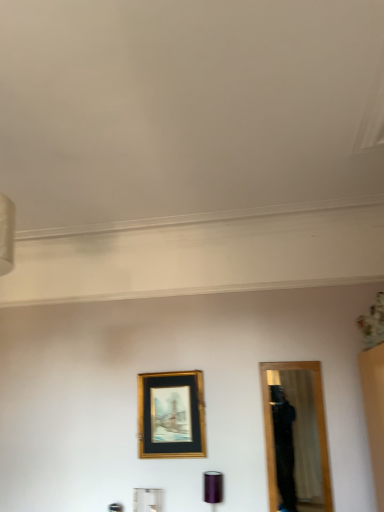
What do you see at coordinates (171, 415) in the screenshot?
I see `gold metallic picture frame at center` at bounding box center [171, 415].

Measure the distance between point (148,392) and camera.

Point (148,392) is 11.16 feet away from camera.

You are a GUI agent. You are given a task and a screenshot of the screen. Output one action in this format:
    pyautogui.click(x=<x>, y=<y>)
    Task: Click on the gold metallic picture frame at center
    
    Given the screenshot: What is the action you would take?
    pyautogui.click(x=171, y=415)

In order to face purple metallic cylinder at lower center, should I rotate leftwards or rightwards?

A 2.907 degree turn to the right will do.

Locate an element on the screen. This screenshot has height=512, width=384. purple metallic cylinder at lower center is located at coordinates (213, 488).

This screenshot has width=384, height=512. What do you see at coordinates (213, 488) in the screenshot?
I see `purple metallic cylinder at lower center` at bounding box center [213, 488].

Identify the location of gold metallic picture frame at center. [171, 415].

Considering the positions of objects gold metallic picture frame at center and purple metallic cylinder at lower center in the image provided, who is more to the left, gold metallic picture frame at center or purple metallic cylinder at lower center?

gold metallic picture frame at center.

In the image, is gold metallic picture frame at center positioned in front of or behind purple metallic cylinder at lower center?

Visually, gold metallic picture frame at center is located behind purple metallic cylinder at lower center.

Does point (180, 452) come behind point (212, 490)?

Yes, point (180, 452) is farther from viewer.

Based on the photo, from the image's perspective, is gold metallic picture frame at center on purple metallic cylinder at lower center?

Yes, from the image's perspective, gold metallic picture frame at center is above purple metallic cylinder at lower center.

From a real-world perspective, is gold metallic picture frame at center positioned under purple metallic cylinder at lower center based on gravity?

No, from a real-world perspective, gold metallic picture frame at center is not beneath purple metallic cylinder at lower center.

In the scene shown: Which of these two, gold metallic picture frame at center or purple metallic cylinder at lower center, is thinner?

Thinner between the two is gold metallic picture frame at center.

Is gold metallic picture frame at center taller or shorter than purple metallic cylinder at lower center?

Clearly, gold metallic picture frame at center is taller compared to purple metallic cylinder at lower center.

Based on their sizes in the image, would you say gold metallic picture frame at center is bigger or smaller than purple metallic cylinder at lower center?

Considering their sizes, gold metallic picture frame at center takes up more space than purple metallic cylinder at lower center.

Can we say gold metallic picture frame at center lies outside purple metallic cylinder at lower center?

That's correct, gold metallic picture frame at center is outside of purple metallic cylinder at lower center.

Is gold metallic picture frame at center not close to purple metallic cylinder at lower center?

No, there isn't a large distance between gold metallic picture frame at center and purple metallic cylinder at lower center.

Could you tell me if gold metallic picture frame at center is turned towards purple metallic cylinder at lower center?

No, gold metallic picture frame at center is not aimed at purple metallic cylinder at lower center.

Consider the image. How many degrees apart are the facing directions of gold metallic picture frame at center and purple metallic cylinder at lower center?

They differ by 0.761 degrees in their facing directions.

How much distance is there between gold metallic picture frame at center and purple metallic cylinder at lower center?

They are 19.01 inches apart.

At what (x,y) coordinates should I click in order to perform the action: click on picture frame that appears on the left of purple metallic cylinder at lower center. Please return your answer as a coordinate pair (x, y). The image size is (384, 512). Looking at the image, I should click on (171, 415).

Which is more to the right, purple metallic cylinder at lower center or gold metallic picture frame at center?

purple metallic cylinder at lower center is more to the right.

Is purple metallic cylinder at lower center in front of gold metallic picture frame at center?

Yes, purple metallic cylinder at lower center is closer to the viewer.

Considering the points (208, 494) and (179, 380), which point is in front, point (208, 494) or point (179, 380)?

The point (208, 494) is closer to the camera.

From the image's perspective, between purple metallic cylinder at lower center and gold metallic picture frame at center, who is located below?

From the image's view, purple metallic cylinder at lower center is below.

From a real-world perspective, which is physically below, purple metallic cylinder at lower center or gold metallic picture frame at center?

From a 3D spatial view, purple metallic cylinder at lower center is below.

Does purple metallic cylinder at lower center have a lesser width compared to gold metallic picture frame at center?

Incorrect, the width of purple metallic cylinder at lower center is not less than that of gold metallic picture frame at center.

In the scene shown: Considering the sizes of purple metallic cylinder at lower center and gold metallic picture frame at center in the image, is purple metallic cylinder at lower center taller or shorter than gold metallic picture frame at center?

Clearly, purple metallic cylinder at lower center is shorter compared to gold metallic picture frame at center.

Who is smaller, purple metallic cylinder at lower center or gold metallic picture frame at center?

With smaller size is purple metallic cylinder at lower center.

Choose the correct answer: Is purple metallic cylinder at lower center inside gold metallic picture frame at center or outside it?

purple metallic cylinder at lower center lies outside gold metallic picture frame at center.

Is there a large distance between purple metallic cylinder at lower center and gold metallic picture frame at center?

No, there isn't a large distance between purple metallic cylinder at lower center and gold metallic picture frame at center.

Is purple metallic cylinder at lower center positioned with its back to gold metallic picture frame at center?

No, gold metallic picture frame at center is not at the back of purple metallic cylinder at lower center.

Measure the distance from purple metallic cylinder at lower center to gold metallic picture frame at center.

purple metallic cylinder at lower center and gold metallic picture frame at center are 19.01 inches apart from each other.

The width and height of the screenshot is (384, 512). I want to click on lamp below the gold metallic picture frame at center (from a real-world perspective), so click(x=213, y=488).

Identify the location of picture frame that appears behind the purple metallic cylinder at lower center. (171, 415).

Identify the location of picture frame on the left of purple metallic cylinder at lower center. (171, 415).